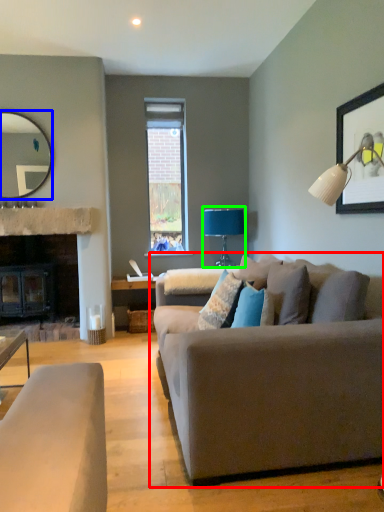
Question: Considering the real-world distances, which object is closest to studio couch (highlighted by a red box)? mirror (highlighted by a blue box) or table lamp (highlighted by a green box).

Choices:
 (A) mirror
 (B) table lamp

Answer: (B)